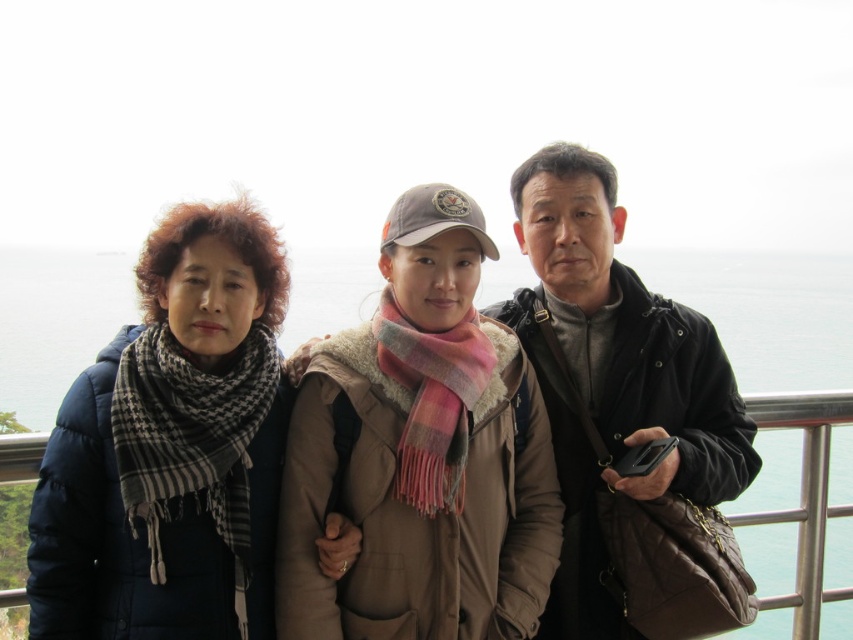
This screenshot has height=640, width=853. What do you see at coordinates (346, 456) in the screenshot? I see `matte black jacket at center` at bounding box center [346, 456].

Who is more forward, (722, 461) or (383, 468)?

Point (383, 468)

Locate an element on the screen. matte black jacket at center is located at coordinates (346, 456).

This screenshot has height=640, width=853. What are the coordinates of `matte black jacket at center` in the screenshot? It's located at click(x=346, y=456).

Between point (270, 492) and point (682, 488), which one is positioned behind?

Positioned behind is point (682, 488).

Can you confirm if matte black jacket at center is positioned above matte black jacket at right?

Incorrect, matte black jacket at center is not positioned above matte black jacket at right.

Does point (694, 397) come farther from viewer compared to point (616, 556)?

Yes, point (694, 397) is farther from viewer.

You are a GUI agent. You are given a task and a screenshot of the screen. Output one action in this format:
    pyautogui.click(x=<x>, y=<y>)
    Task: Click on the matte black jacket at center
    The height and width of the screenshot is (640, 853).
    Given the screenshot: What is the action you would take?
    346,456

Is point (200, 356) positioned before point (209, 602)?

No, (200, 356) is further to viewer.

Does point (540, 604) come behind point (167, 612)?

Yes, point (540, 604) is behind point (167, 612).

Who is more forward, (479, 628) or (129, 586)?

Point (129, 586) is more forward.

At what (x,y) coordinates should I click in order to perform the action: click on matte black jacket at center. Please return your answer as a coordinate pair (x, y). Image resolution: width=853 pixels, height=640 pixels. Looking at the image, I should click on (346, 456).